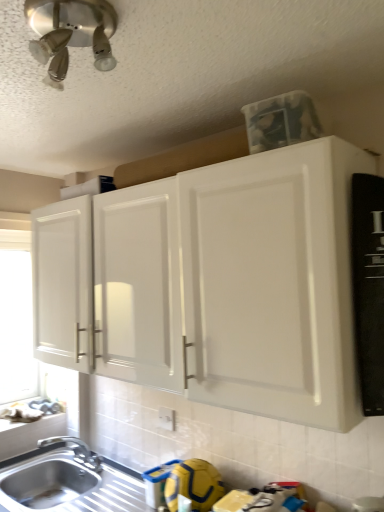
Question: Is stainless steel sink at lower left a part of white matte cabinet at upper center?

Choices:
 (A) no
 (B) yes

Answer: (A)

Question: Considering the relative positions of white matte cabinet at upper center and stainless steel sink at lower left in the image provided, is white matte cabinet at upper center to the right of stainless steel sink at lower left from the viewer's perspective?

Choices:
 (A) no
 (B) yes

Answer: (B)

Question: Is the surface of white matte cabinet at upper center in direct contact with stainless steel sink at lower left?

Choices:
 (A) no
 (B) yes

Answer: (A)

Question: From a real-world perspective, is white matte cabinet at upper center located beneath stainless steel sink at lower left?

Choices:
 (A) yes
 (B) no

Answer: (B)

Question: From the image's perspective, is white matte cabinet at upper center below stainless steel sink at lower left?

Choices:
 (A) no
 (B) yes

Answer: (A)

Question: From a real-world perspective, is white matte window screen at left above or below stainless steel sink at lower left?

Choices:
 (A) below
 (B) above

Answer: (B)

Question: From the image's perspective, is white matte window screen at left above or below stainless steel sink at lower left?

Choices:
 (A) above
 (B) below

Answer: (A)

Question: Relative to stainless steel sink at lower left, is white matte window screen at left in front or behind?

Choices:
 (A) front
 (B) behind

Answer: (B)

Question: Would you say white matte window screen at left is to the left or to the right of stainless steel sink at lower left in the picture?

Choices:
 (A) left
 (B) right

Answer: (A)

Question: Visually, is satin nickel light fixture at upper left positioned to the left or to the right of silver metallic faucet at lower left?

Choices:
 (A) left
 (B) right

Answer: (B)

Question: Considering the positions of satin nickel light fixture at upper left and silver metallic faucet at lower left in the image, is satin nickel light fixture at upper left wider or thinner than silver metallic faucet at lower left?

Choices:
 (A) thin
 (B) wide

Answer: (A)

Question: From a real-world perspective, relative to silver metallic faucet at lower left, is satin nickel light fixture at upper left vertically above or below?

Choices:
 (A) below
 (B) above

Answer: (B)

Question: Is satin nickel light fixture at upper left taller or shorter than silver metallic faucet at lower left?

Choices:
 (A) tall
 (B) short

Answer: (B)

Question: Considering their positions, is white matte cabinet at upper center located in front of or behind satin nickel light fixture at upper left?

Choices:
 (A) front
 (B) behind

Answer: (B)

Question: Considering the positions of point (178, 259) and point (82, 22), is point (178, 259) closer or farther from the camera than point (82, 22)?

Choices:
 (A) farther
 (B) closer

Answer: (A)